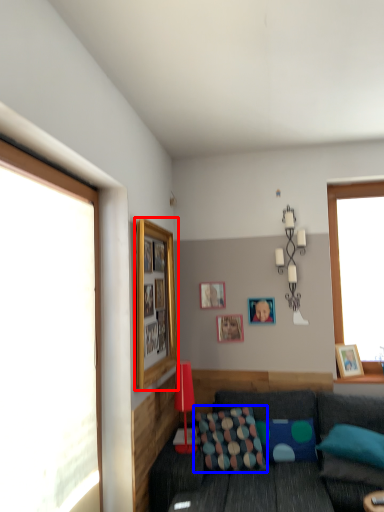
Question: Which point is further to the camera, picture frame (highlighted by a red box) or pillow (highlighted by a blue box)?

Choices:
 (A) picture frame
 (B) pillow

Answer: (B)